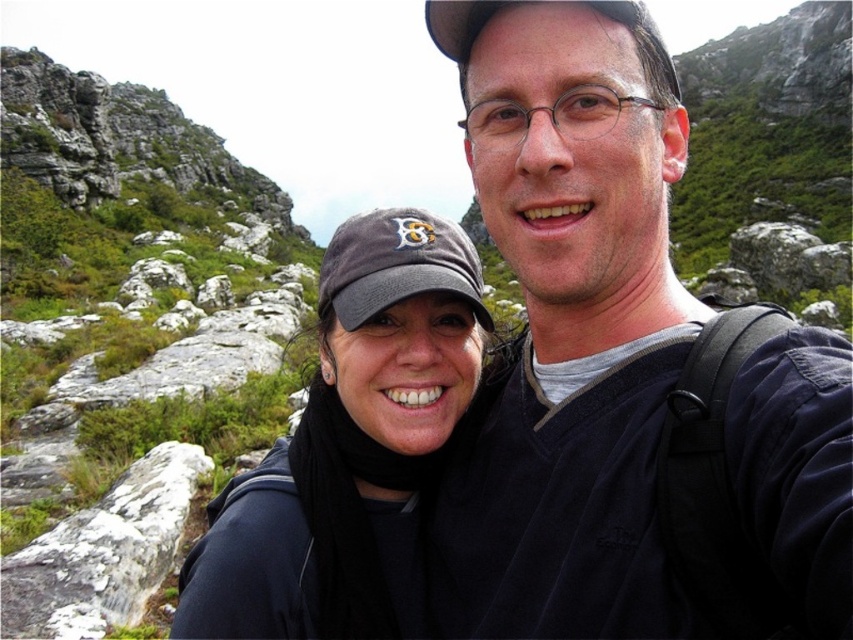
Question: Which object is farther from the camera taking this photo?

Choices:
 (A) dark gray fabric baseball cap at center
 (B) white textured rock at lower left

Answer: (A)

Question: Which object is positioned farthest from the dark gray fabric baseball cap at center?

Choices:
 (A) matte black jacket at center
 (B) dark gray fabric cap at center
 (C) white textured rock at lower left

Answer: (C)

Question: Which point is closer to the camera taking this photo?

Choices:
 (A) (379, 321)
 (B) (554, 579)
 (C) (173, 497)

Answer: (B)

Question: Is white textured rock at lower left to the right of dark gray fabric baseball cap at center from the viewer's perspective?

Choices:
 (A) no
 (B) yes

Answer: (A)

Question: Is dark gray fabric cap at center smaller than white textured rock at lower left?

Choices:
 (A) yes
 (B) no

Answer: (B)

Question: Can you confirm if matte black jacket at center is positioned to the right of white textured rock at lower left?

Choices:
 (A) no
 (B) yes

Answer: (B)